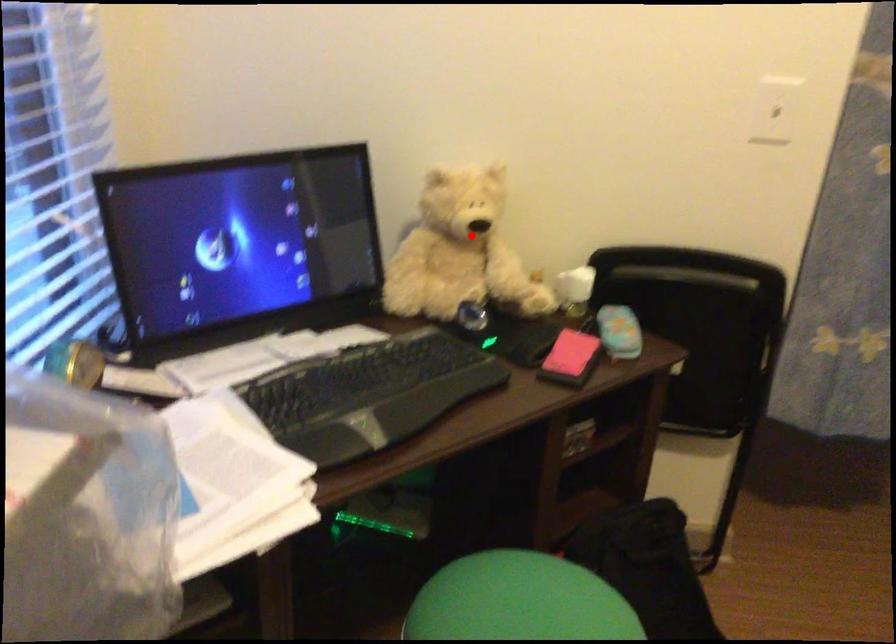
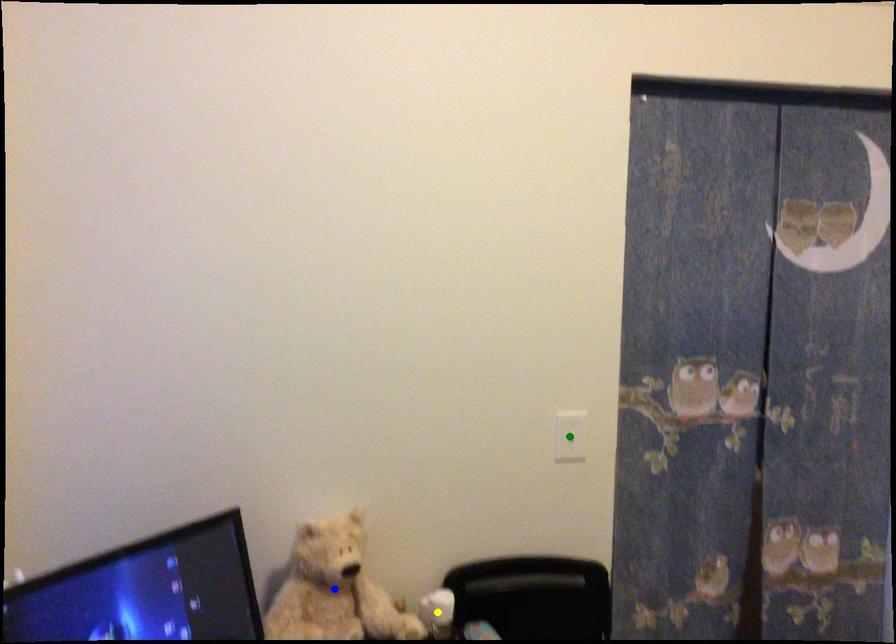
Question: I am providing you with two images of the same scene from different viewpoints. A red point is marked on the first image. You are given multiple points on the second image. Which spot in image 2 lines up with the point in image 1?

Choices:
 (A) yellow point
 (B) blue point
 (C) green point

Answer: (B)